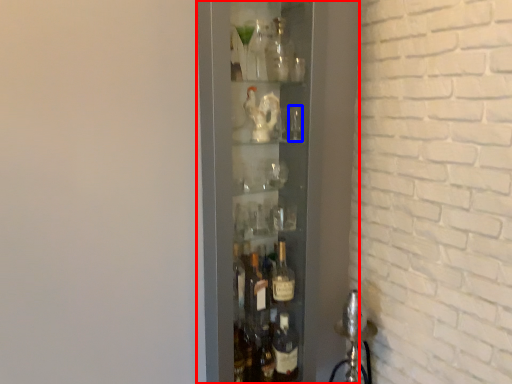
Question: Which point is further to the camera, shelf (highlighted by a red box) or shot glass (highlighted by a blue box)?

Choices:
 (A) shelf
 (B) shot glass

Answer: (B)